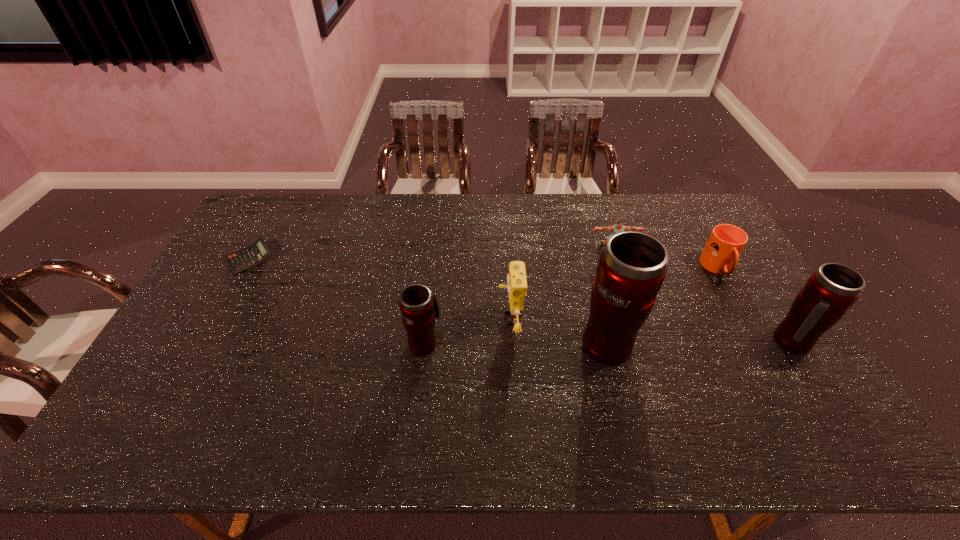
Locate an element on the screen. The width and height of the screenshot is (960, 540). object that is the fourth closest to the third object from left to right is located at coordinates coord(721,253).

Select which object appears as the fourth closest to the puncher. Please provide its 2D coordinates. Your answer should be formatted as a tuple, i.e. [(x, y)], where the tuple contains the x and y coordinates of a point satisfying the conditions above.

[(830, 291)]

Locate an element on the screen. This screenshot has height=540, width=960. thermos bottle that is the third closest one to the mug is located at coordinates (418, 305).

Find the location of a particular element. This screenshot has width=960, height=540. the second closest thermos bottle to the puncher is located at coordinates (830, 291).

Where is `blank space that satisfies the following two spatial constraints: 1. on the face of the third object from left to right; 2. on the side with the handle of the tallest thermos bottle`? This screenshot has width=960, height=540. blank space that satisfies the following two spatial constraints: 1. on the face of the third object from left to right; 2. on the side with the handle of the tallest thermos bottle is located at coordinates (511, 342).